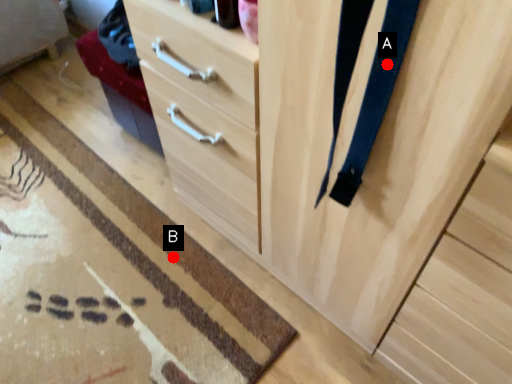
Question: Two points are circled on the image, labeled by A and B beside each circle. Which of the following is the farthest from the observer?

Choices:
 (A) A is further
 (B) B is further

Answer: (B)